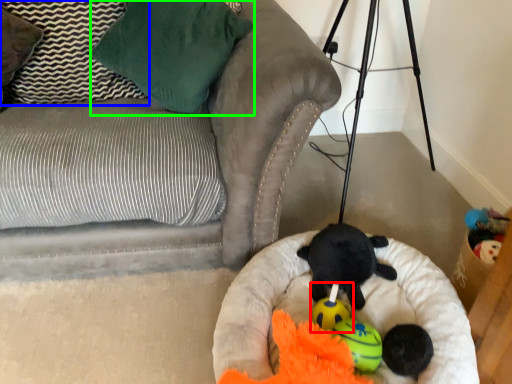
Question: Which object is the closest to the toy (highlighted by a red box)? Choose among these: pillow (highlighted by a blue box) or pillow (highlighted by a green box).

Choices:
 (A) pillow
 (B) pillow

Answer: (B)